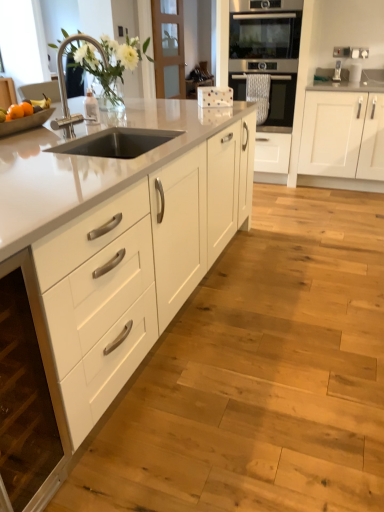
Question: Considering the relative positions of orange matte fruit at left, marked as the 1th orange in a back-to-front arrangement, and orange matte at left, the first orange in the front-to-back sequence, in the image provided, is orange matte fruit at left, marked as the 1th orange in a back-to-front arrangement, to the right of orange matte at left, the first orange in the front-to-back sequence, from the viewer's perspective?

Choices:
 (A) yes
 (B) no

Answer: (A)

Question: Does orange matte fruit at left, marked as the 1th orange in a back-to-front arrangement, turn towards orange matte at left, acting as the second orange starting from the back?

Choices:
 (A) no
 (B) yes

Answer: (A)

Question: From the image's perspective, would you say orange matte fruit at left, the second orange in the front-to-back sequence, is positioned over orange matte at left, acting as the second orange starting from the back?

Choices:
 (A) no
 (B) yes

Answer: (B)

Question: Is orange matte fruit at left, the second orange in the front-to-back sequence, closer to camera compared to orange matte at left, the first orange in the front-to-back sequence?

Choices:
 (A) no
 (B) yes

Answer: (A)

Question: Considering the relative sizes of orange matte fruit at left, the second orange in the front-to-back sequence, and orange matte at left, the first orange in the front-to-back sequence, in the image provided, is orange matte fruit at left, the second orange in the front-to-back sequence, shorter than orange matte at left, the first orange in the front-to-back sequence,?

Choices:
 (A) yes
 (B) no

Answer: (B)

Question: Does orange matte fruit at left, the second orange in the front-to-back sequence, touch orange matte at left, acting as the second orange starting from the back?

Choices:
 (A) no
 (B) yes

Answer: (B)

Question: Does orange matte fruit at left, marked as the 1th orange in a back-to-front arrangement, appear on the left side of white matte cabinet at lower left, placed as the second cabinetry when sorted from right to left?

Choices:
 (A) no
 (B) yes

Answer: (B)

Question: Is orange matte fruit at left, marked as the 1th orange in a back-to-front arrangement, shorter than white matte cabinet at lower left, placed as the second cabinetry when sorted from right to left?

Choices:
 (A) no
 (B) yes

Answer: (B)

Question: Can you confirm if orange matte fruit at left, the second orange in the front-to-back sequence, is wider than white matte cabinet at lower left, placed as the second cabinetry when sorted from right to left?

Choices:
 (A) yes
 (B) no

Answer: (B)

Question: From the image's perspective, does orange matte fruit at left, the second orange in the front-to-back sequence, appear lower than white matte cabinet at lower left, placed as the second cabinetry when sorted from right to left?

Choices:
 (A) no
 (B) yes

Answer: (A)

Question: From a real-world perspective, is orange matte fruit at left, the second orange in the front-to-back sequence, located beneath white matte cabinet at lower left, placed as the second cabinetry when sorted from right to left?

Choices:
 (A) yes
 (B) no

Answer: (B)

Question: Does orange matte fruit at left, the second orange in the front-to-back sequence, appear on the right side of white matte cabinet at lower left, placed as the second cabinetry when sorted from right to left?

Choices:
 (A) yes
 (B) no

Answer: (B)

Question: Does white matte cabinet at right, which is the first cabinetry from right to left, have a greater height compared to stainless steel oven at center, the 2th oven viewed from the top?

Choices:
 (A) yes
 (B) no

Answer: (A)